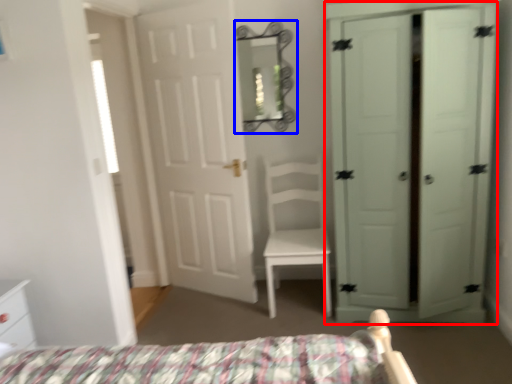
Question: Which of the following is the farthest to the observer, door (highlighted by a red box) or mirror (highlighted by a blue box)?

Choices:
 (A) door
 (B) mirror

Answer: (B)